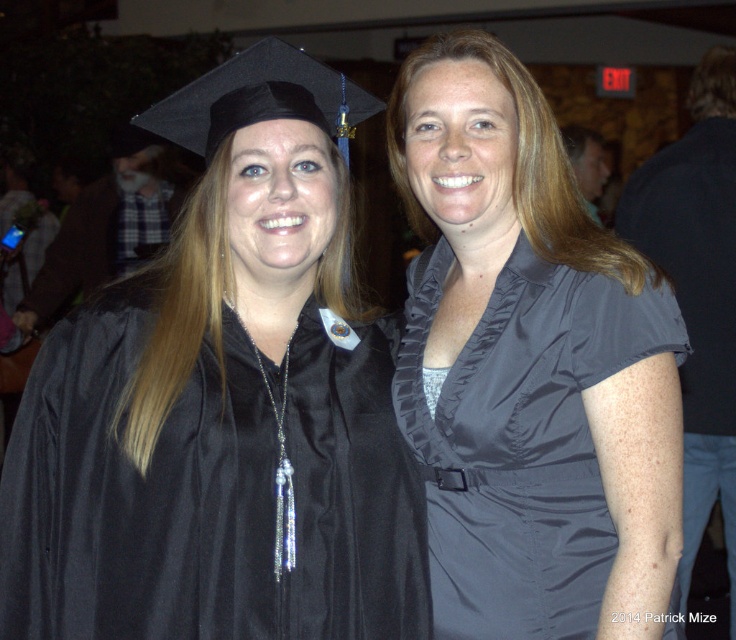
Question: Which point is farther to the camera?

Choices:
 (A) (634, 241)
 (B) (330, 468)
 (C) (445, 557)

Answer: (A)

Question: Which point is closer to the camera?

Choices:
 (A) (718, 493)
 (B) (431, 204)

Answer: (B)

Question: Can you confirm if matte black graduation gown at center is smaller than satin gray blouse at center?

Choices:
 (A) no
 (B) yes

Answer: (B)

Question: Which of the following is the farthest from the observer?

Choices:
 (A) (640, 225)
 (B) (272, 182)

Answer: (A)

Question: Can you confirm if matte black graduation gown at center is positioned below satin gray blouse at center?

Choices:
 (A) yes
 (B) no

Answer: (A)

Question: Considering the relative positions of matte black graduation gown at center and satin gray blouse at center in the image provided, where is matte black graduation gown at center located with respect to satin gray blouse at center?

Choices:
 (A) below
 (B) above

Answer: (A)